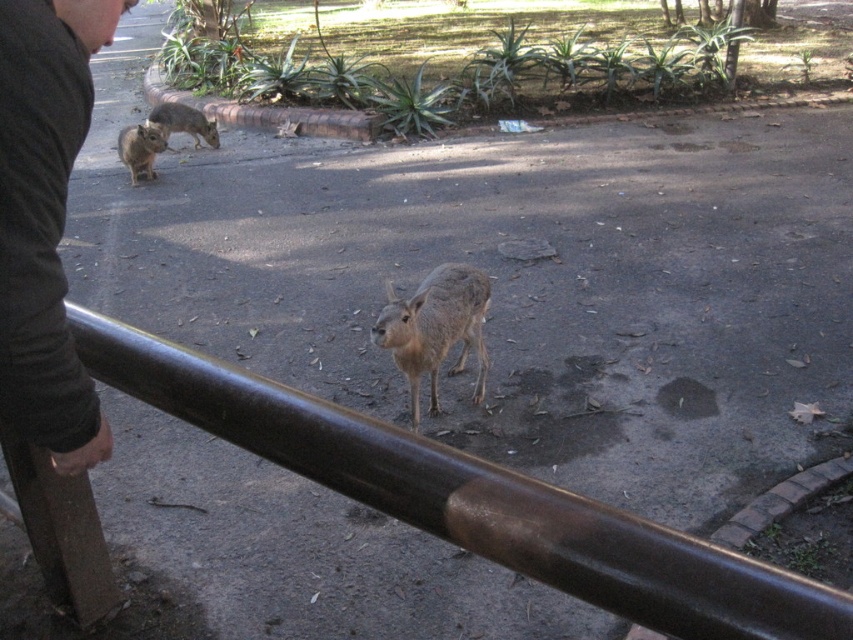
Question: Is black fabric at left thinner than fur-like gray animal at center?

Choices:
 (A) no
 (B) yes

Answer: (B)

Question: Which point is closer to the camera?

Choices:
 (A) (242, 404)
 (B) (183, 115)
 (C) (39, 372)
 (D) (149, 179)

Answer: (C)

Question: Can you confirm if brown polished metal rail at center is positioned to the right of fur-like gray animal at center?

Choices:
 (A) yes
 (B) no

Answer: (B)

Question: Which of the following is the closest to the observer?

Choices:
 (A) (419, 522)
 (B) (469, 291)

Answer: (A)

Question: Is fur-like gray animal at center above furry gray rabbit at upper left?

Choices:
 (A) no
 (B) yes

Answer: (A)

Question: Which object is closer to the camera taking this photo?

Choices:
 (A) black fabric at left
 (B) brown furry rodent at left

Answer: (A)